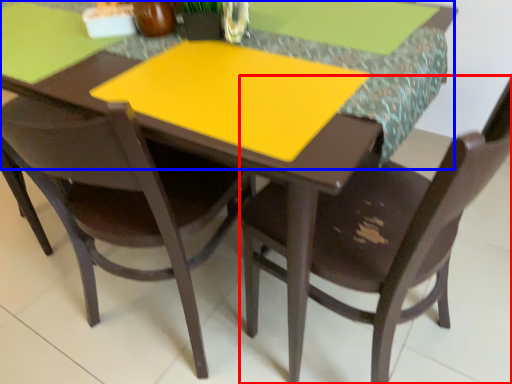
Question: Which object is closer to the camera taking this photo, chair (highlighted by a red box) or counter top (highlighted by a blue box)?

Choices:
 (A) chair
 (B) counter top

Answer: (A)